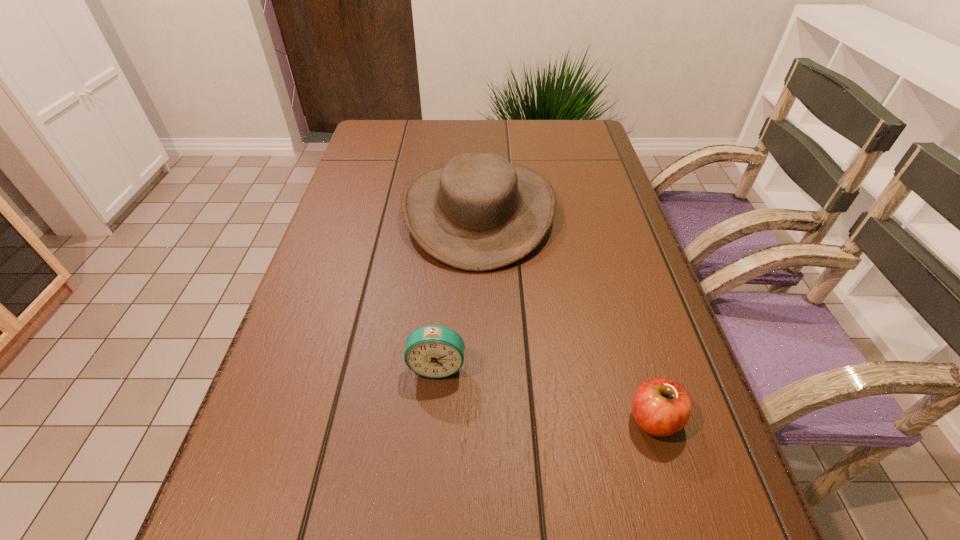
The height and width of the screenshot is (540, 960). I want to click on vacant space at the far edge of the desktop, so click(x=501, y=127).

Locate an element on the screen. Image resolution: width=960 pixels, height=540 pixels. vacant space at the left edge of the desktop is located at coordinates (342, 210).

Locate an element on the screen. This screenshot has height=540, width=960. vacant space at the right edge of the desktop is located at coordinates (640, 250).

The width and height of the screenshot is (960, 540). In the image, there is a desktop. What are the coordinates of `blank space at the far left corner` in the screenshot? It's located at (366, 133).

This screenshot has width=960, height=540. What are the coordinates of `unoccupied area between the rightmost object and the alarm clock` in the screenshot? It's located at (545, 393).

Where is `blank region between the apple and the farthest object`? blank region between the apple and the farthest object is located at coordinates (566, 315).

Locate an element on the screen. vacant space that is in between the shortest object and the second shortest object is located at coordinates (545, 393).

What are the coordinates of `vacant area between the tallest object and the second nearest object` in the screenshot? It's located at (458, 288).

Image resolution: width=960 pixels, height=540 pixels. Find the location of `unoccupied area between the nearest object and the tallest object`. unoccupied area between the nearest object and the tallest object is located at coordinates (566, 315).

Locate an element on the screen. empty space that is in between the rightmost object and the cowboy hat is located at coordinates (566, 315).